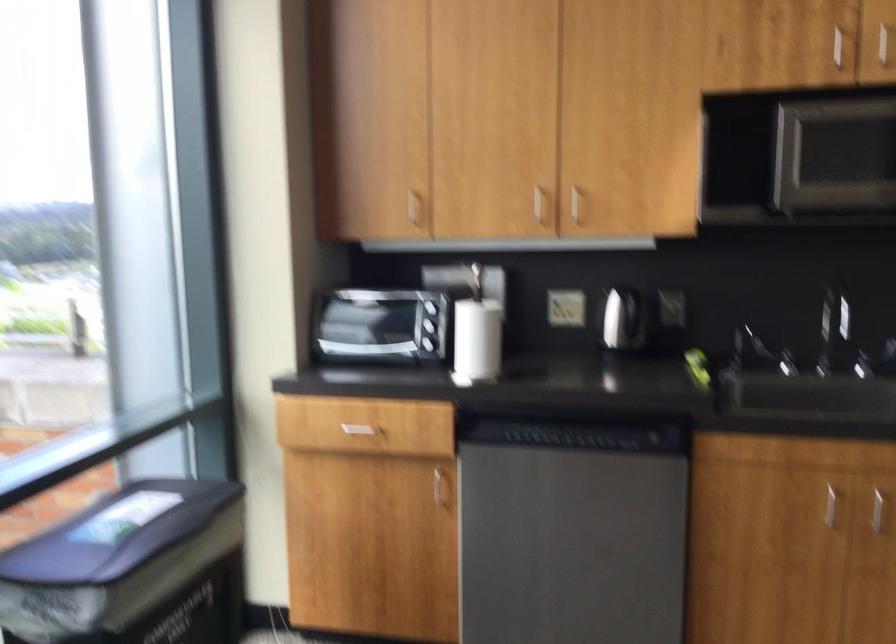
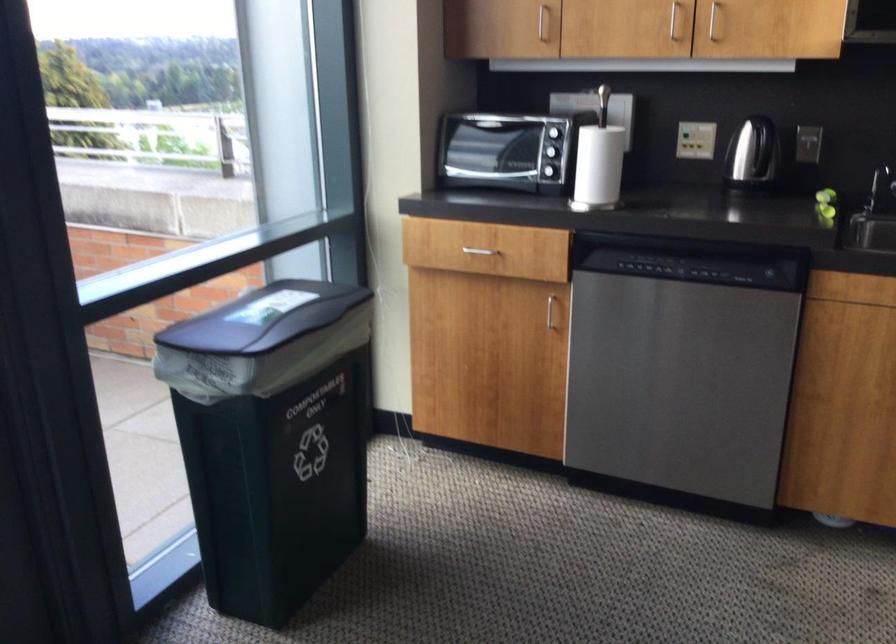
In the second image, find the point that corresponds to point 419,202 in the first image.

(543, 23)